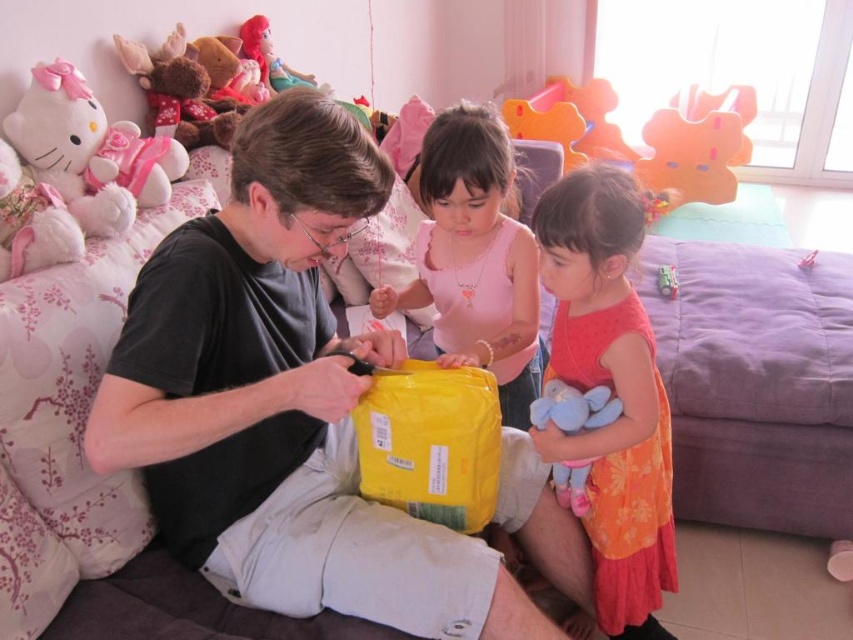
You are standing in the room and want to take a photo of the black matte shirt at center with your camera. The camera requires a minimum distance of 36 inches to focus properly. Can you take a clear photo from your current position?

The black matte shirt at center and camera are 38.86 inches apart from each other. Since 38.86 inches is greater than the minimum required 36 inches, you can take a clear photo from your current position.

In the scene shown: You are a photographer trying to capture a closeup of the soft plush toy at lower right and the shiny plastic doll at upper left. Which object should you focus on first to ensure it appears sharp in the photo?

You should focus on the soft plush toy at lower right first because it is closer to the viewer than the shiny plastic doll at upper left.